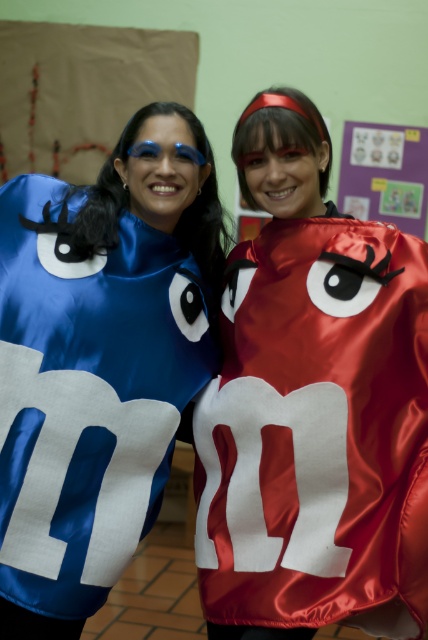
Question: Which point is farther to the camera?

Choices:
 (A) satin shiny m&m at center
 (B) satin blue m&m at left

Answer: (B)

Question: Which object is farther from the camera taking this photo?

Choices:
 (A) satin blue m&m at left
 (B) satin shiny m&m at center

Answer: (A)

Question: Is satin shiny m&m at center thinner than satin blue m&m at left?

Choices:
 (A) yes
 (B) no

Answer: (B)

Question: Is satin shiny m&m at center above satin blue m&m at left?

Choices:
 (A) no
 (B) yes

Answer: (A)

Question: Does satin shiny m&m at center have a larger size compared to satin blue m&m at left?

Choices:
 (A) no
 (B) yes

Answer: (B)